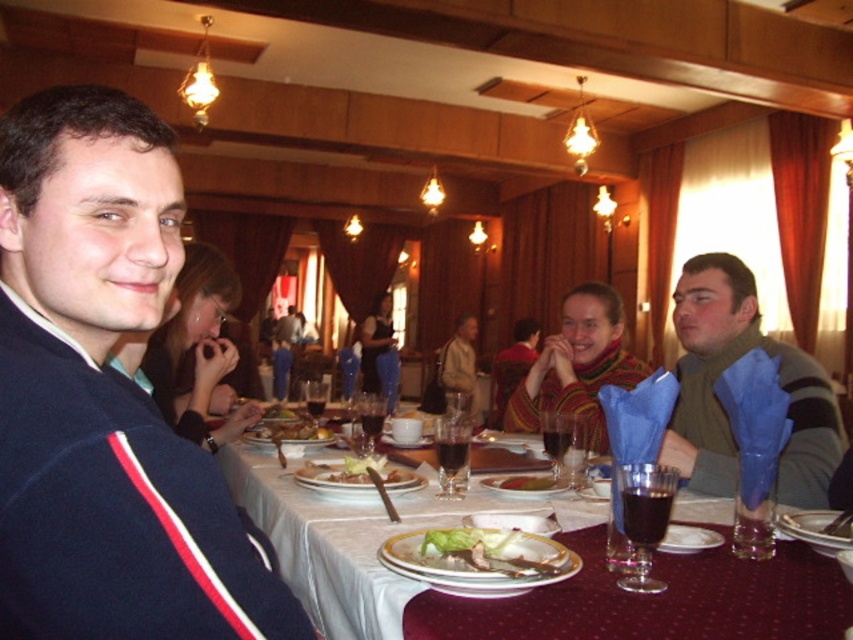
Question: Is maroon fabric table at center thinner than white porcelain plate at center?

Choices:
 (A) yes
 (B) no

Answer: (B)

Question: Which point is closer to the camera?

Choices:
 (A) coord(480,476)
 (B) coord(547,484)
 (C) coord(154,186)
 (D) coord(515,554)

Answer: (C)

Question: Based on their relative distances, which object is nearer to the golden brown bread at center?

Choices:
 (A) green leafy salad at center
 (B) white porcelain plate at center

Answer: (B)

Question: Can you confirm if green leafy lettuce at center is positioned to the left of white porcelain plate at center?

Choices:
 (A) yes
 (B) no

Answer: (B)

Question: Which object is closer to the camera taking this photo?

Choices:
 (A) green leafy lettuce at center
 (B) maroon fabric table at center
 (C) golden brown bread at center

Answer: (A)

Question: Can you confirm if maroon fabric table at center is thinner than green leafy lettuce at center?

Choices:
 (A) no
 (B) yes

Answer: (A)